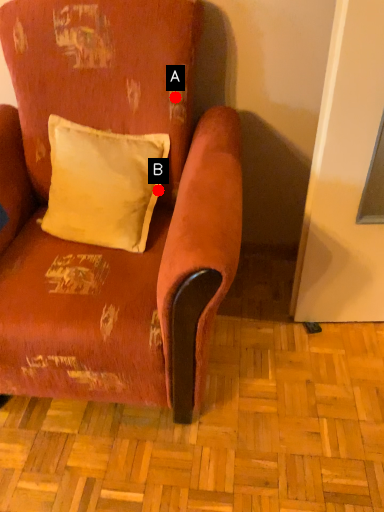
Question: Two points are circled on the image, labeled by A and B beside each circle. Which point is farther to the camera?

Choices:
 (A) A is further
 (B) B is further

Answer: (B)